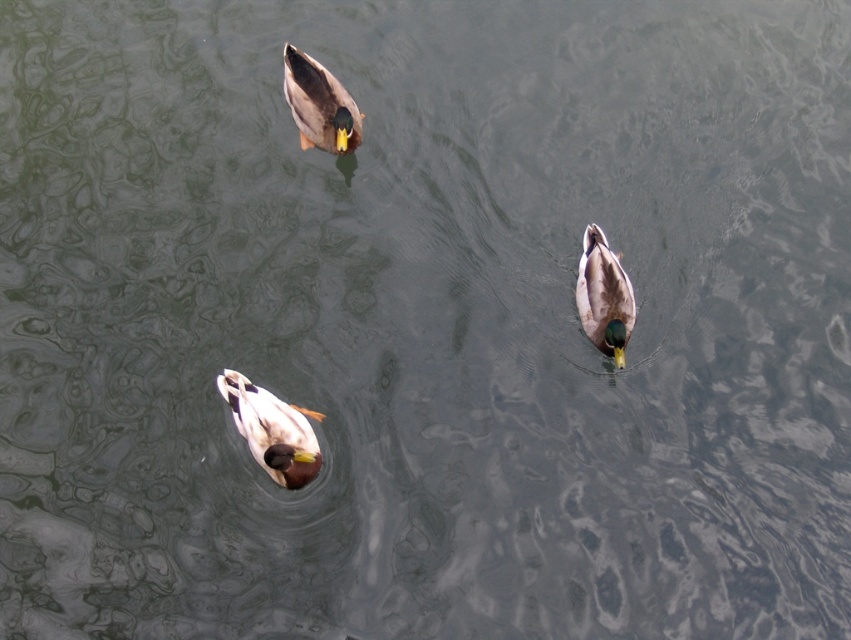
Looking at this image, you are observing three ducks swimming on a calm body of water. You see the brown glossy duck at upper left and the other ducks. Based on their positions, which duck is closest to the upper left corner of the image?

The brown glossy duck at upper left is closest to the upper left corner of the image as it is positioned at point [318,104] which is nearest to that corner compared to the other ducks.

You are a birdwatcher observing the ducks in the scene. You notice the brown glossy duck at upper left and the brown matte duck at center. Which duck would cast a larger shadow if the sun is directly overhead?

The brown glossy duck at upper left is bigger than the brown matte duck at center, so it would cast a larger shadow.